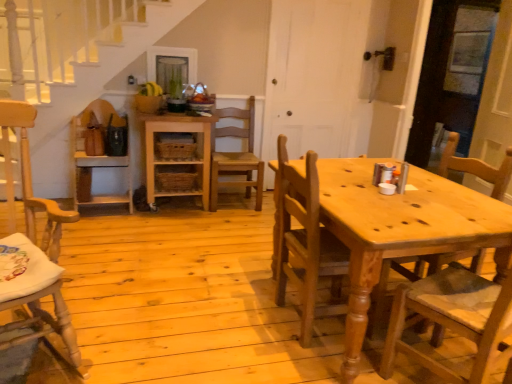
Question: Should I look upward or downward to see wooden chair at center, the 3th chair viewed from the right?

Choices:
 (A) up
 (B) down

Answer: (A)

Question: Can you confirm if natural wood shelf at center is smaller than wooden chair at center, the 3th chair viewed from the right?

Choices:
 (A) no
 (B) yes

Answer: (A)

Question: Is natural wood shelf at center not inside wooden chair at center, arranged as the 3th chair when viewed from the left?

Choices:
 (A) no
 (B) yes

Answer: (B)

Question: Can you confirm if natural wood shelf at center is wider than wooden chair at center, the 3th chair viewed from the right?

Choices:
 (A) no
 (B) yes

Answer: (B)

Question: From a real-world perspective, is natural wood shelf at center beneath wooden chair at center, the 3th chair viewed from the right?

Choices:
 (A) yes
 (B) no

Answer: (A)

Question: Considering the relative positions of natural wood shelf at center and wooden chair at center, arranged as the 3th chair when viewed from the left, in the image provided, is natural wood shelf at center to the left of wooden chair at center, arranged as the 3th chair when viewed from the left, from the viewer's perspective?

Choices:
 (A) no
 (B) yes

Answer: (B)

Question: From the image's perspective, is natural wood shelf at center beneath wooden chair at center, arranged as the 3th chair when viewed from the left?

Choices:
 (A) yes
 (B) no

Answer: (A)

Question: Does natural wood shelf at center lie in front of wooden chair at center, which is counted as the 5th chair, starting from the right?

Choices:
 (A) no
 (B) yes

Answer: (A)

Question: Is natural wood shelf at center wider than wooden chair at center, which is counted as the 5th chair, starting from the right?

Choices:
 (A) no
 (B) yes

Answer: (B)

Question: Is natural wood shelf at center facing away from wooden chair at center, the first chair positioned from the left?

Choices:
 (A) no
 (B) yes

Answer: (A)

Question: Does natural wood shelf at center have a greater height compared to wooden chair at center, the first chair positioned from the left?

Choices:
 (A) yes
 (B) no

Answer: (B)

Question: Does natural wood shelf at center contain wooden chair at center, the first chair positioned from the left?

Choices:
 (A) no
 (B) yes

Answer: (A)

Question: Can you confirm if natural wood shelf at center is thinner than wooden chair at center, which is counted as the 5th chair, starting from the right?

Choices:
 (A) yes
 (B) no

Answer: (B)

Question: Is natural wood chair at center, which appears as the second chair when viewed from the right, oriented away from wooden chair at right, marked as the first chair in a right-to-left arrangement?

Choices:
 (A) no
 (B) yes

Answer: (A)